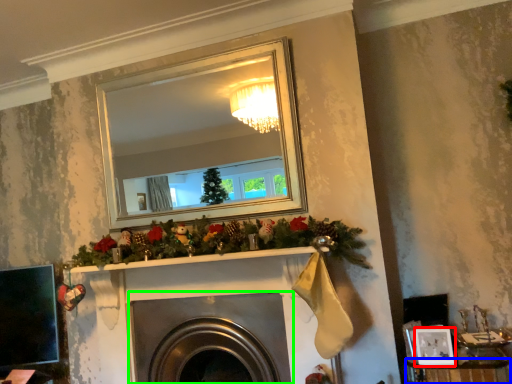
Question: Which is nearer to the picture frame (highlighted by a red box)? furniture (highlighted by a blue box) or fireplace (highlighted by a green box).

Choices:
 (A) furniture
 (B) fireplace

Answer: (A)